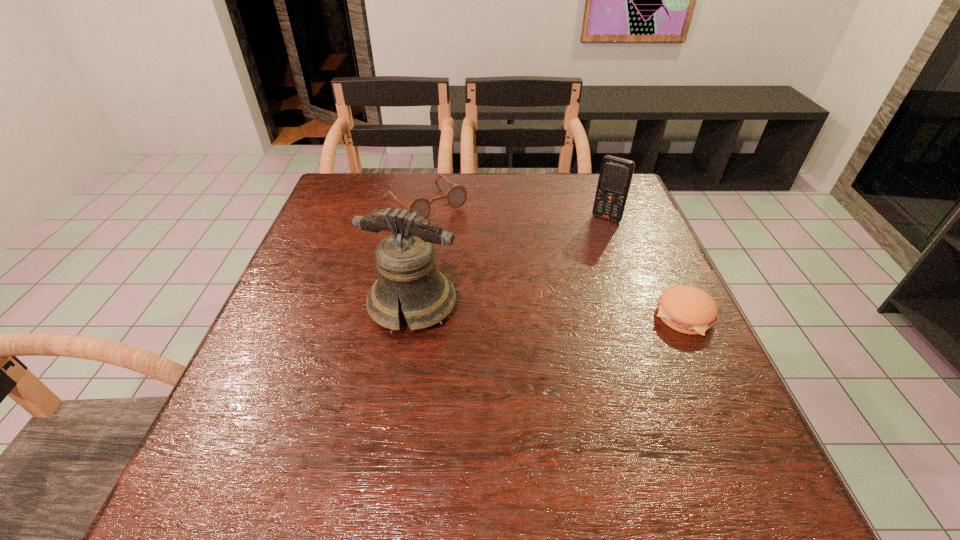
Locate an element on the screen. The height and width of the screenshot is (540, 960). vacant space at the far left corner is located at coordinates (330, 190).

The width and height of the screenshot is (960, 540). I want to click on free space at the far right corner, so click(x=598, y=173).

The width and height of the screenshot is (960, 540). I want to click on vacant space at the near right corner of the desktop, so click(x=728, y=421).

Find the location of a particular element. This screenshot has height=540, width=960. vacant area that lies between the tallest object and the cellular telephone is located at coordinates (510, 262).

Locate an element on the screen. vacant space that's between the cellular telephone and the second shortest object is located at coordinates click(x=516, y=210).

The image size is (960, 540). In order to click on free space between the third tallest object and the shortest object in this screenshot , I will do `click(555, 259)`.

You are a GUI agent. You are given a task and a screenshot of the screen. Output one action in this format:
    pyautogui.click(x=<x>, y=<y>)
    Task: Click on the free point between the tallest object and the patty
    
    Given the screenshot: What is the action you would take?
    pyautogui.click(x=548, y=310)

I want to click on vacant region between the patty and the spectacles, so click(x=555, y=259).

What are the coordinates of `vacant area that lies between the cellular telephone and the tallest object` in the screenshot? It's located at (510, 262).

The image size is (960, 540). What are the coordinates of `vacant space that's between the bell and the second tallest object` in the screenshot? It's located at (510, 262).